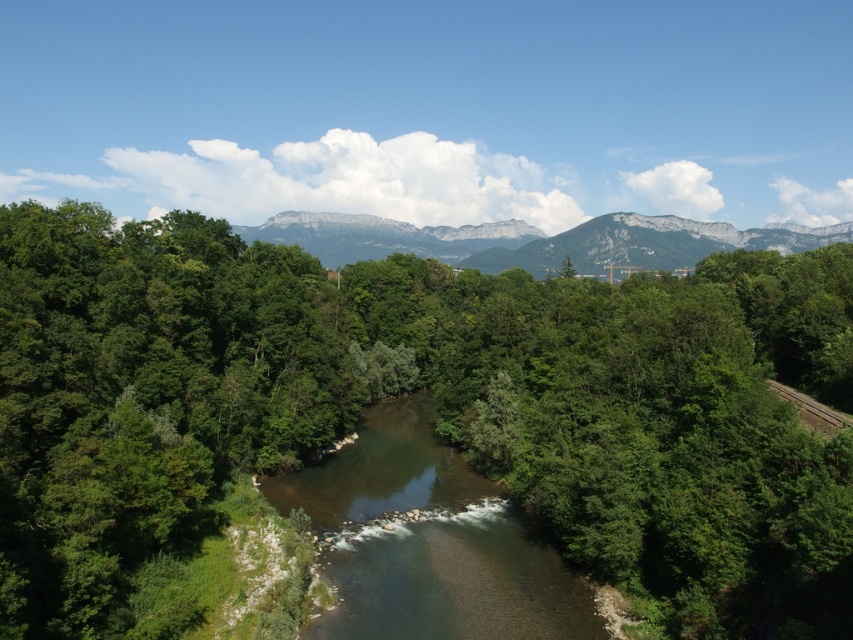
Question: Is rocky gray mountain at center above brown wooden train track at right?

Choices:
 (A) yes
 (B) no

Answer: (A)

Question: Among these objects, which one is farthest from the camera?

Choices:
 (A) rocky gray mountain at center
 (B) clear water stream at center

Answer: (A)

Question: Does green leafy forest at center appear over brown wooden train track at right?

Choices:
 (A) no
 (B) yes

Answer: (B)

Question: Among these points, which one is nearest to the camera?

Choices:
 (A) 741,348
 (B) 848,240
 (C) 495,579

Answer: (C)

Question: Which of these objects is positioned farthest from the brown wooden train track at right?

Choices:
 (A) green leafy forest at center
 (B) clear water stream at center
 (C) rocky gray mountain at center

Answer: (C)

Question: Does green leafy forest at center have a greater width compared to rocky gray mountain at center?

Choices:
 (A) no
 (B) yes

Answer: (A)